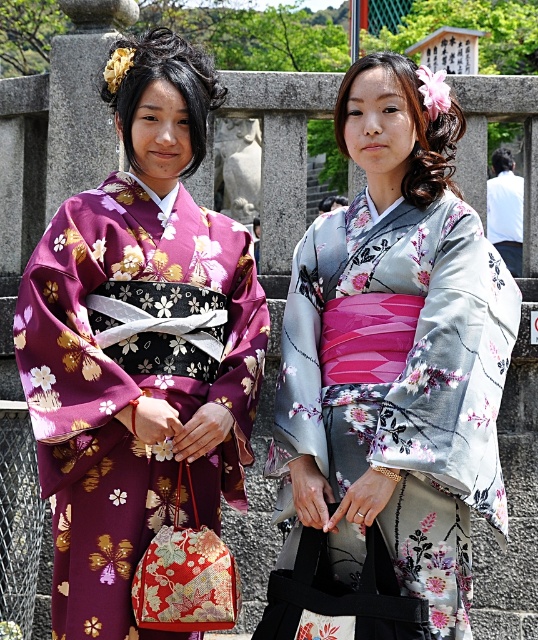
Can you confirm if matte floral kimono at center is smaller than silky floral kimono at center?

No, matte floral kimono at center is not smaller than silky floral kimono at center.

Is point (168, 461) positioned after point (363, 83)?

No, it is in front of (363, 83).

Locate an element on the screen. matte floral kimono at center is located at coordinates (138, 344).